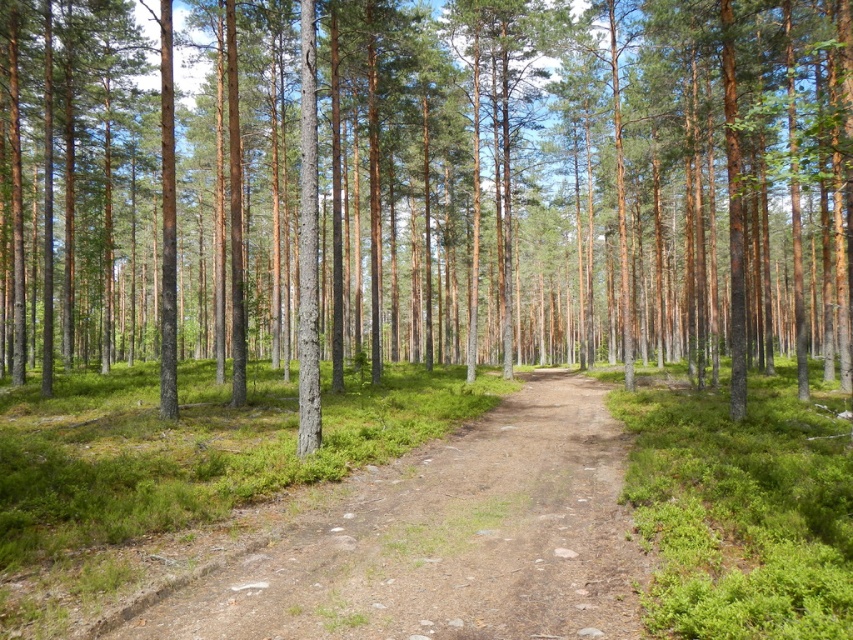
Is brown bark tree at center wider than brown dirt track at center?

Yes, brown bark tree at center is wider than brown dirt track at center.

How far apart are brown bark tree at center and brown dirt track at center?

brown bark tree at center and brown dirt track at center are 33.53 meters apart from each other.

Is point (851, 214) positioned after point (519, 636)?

That is True.

Find the location of a particular element. The height and width of the screenshot is (640, 853). brown bark tree at center is located at coordinates (579, 184).